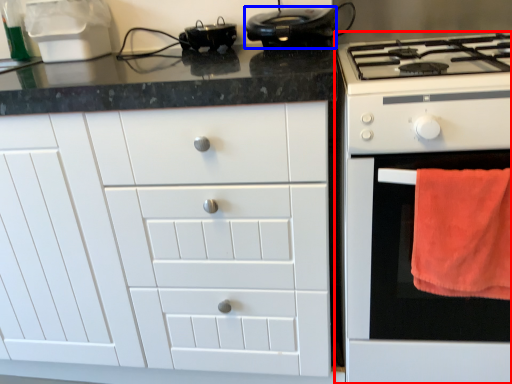
Question: Which object is further to the camera taking this photo, home appliance (highlighted by a red box) or kitchen appliance (highlighted by a blue box)?

Choices:
 (A) home appliance
 (B) kitchen appliance

Answer: (B)